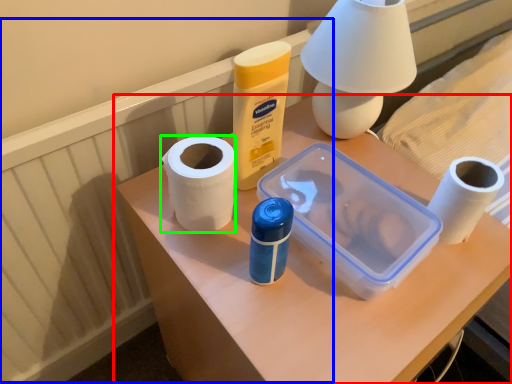
Question: Based on their relative distances, which object is nearer to table (highlighted by a red box)? Choose from radiator (highlighted by a blue box) and paper towel (highlighted by a green box).

Choices:
 (A) radiator
 (B) paper towel

Answer: (B)